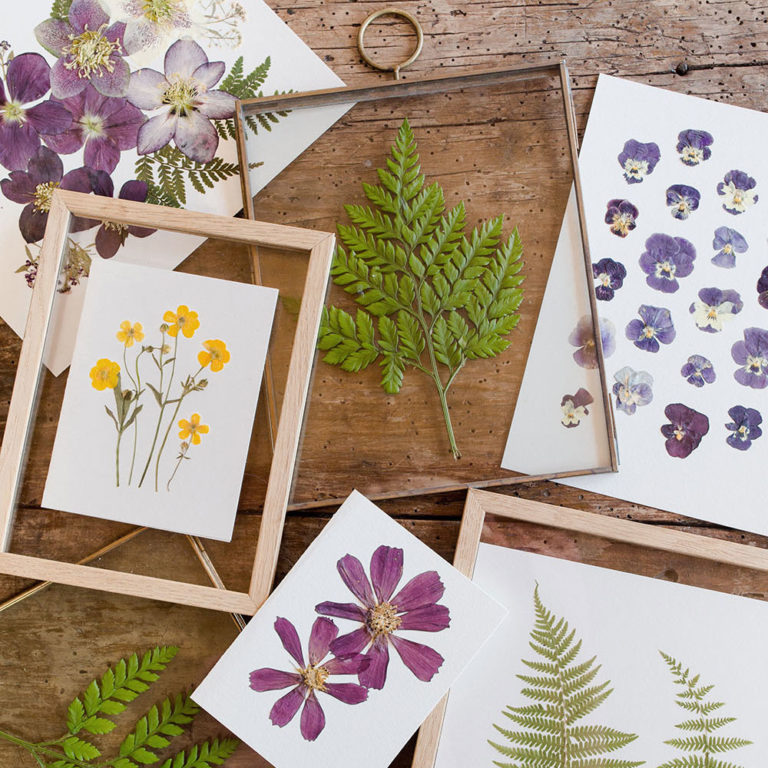
The width and height of the screenshot is (768, 768). What are the coordinates of `display frames` in the screenshot? It's located at (494, 77), (518, 482), (545, 522), (280, 447), (30, 594), (212, 568).